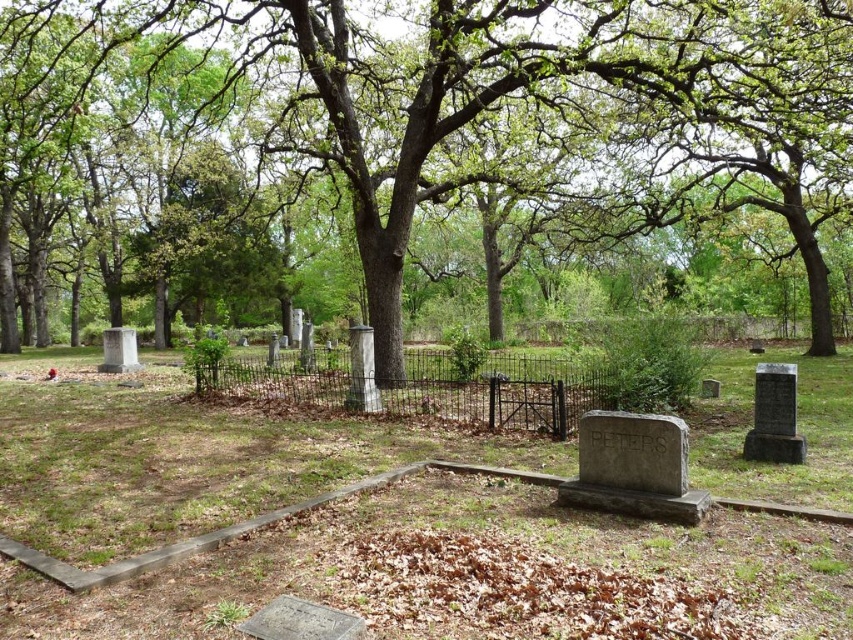
The image size is (853, 640). What do you see at coordinates (190, 456) in the screenshot? I see `gray stone marker at center` at bounding box center [190, 456].

Is point (537, 465) farther from viewer compared to point (607, 465)?

Yes.

This screenshot has width=853, height=640. What do you see at coordinates (190, 456) in the screenshot?
I see `gray stone marker at center` at bounding box center [190, 456].

This screenshot has width=853, height=640. Identify the location of gray stone marker at center. (190, 456).

This screenshot has height=640, width=853. Find the location of `green leafy tree at center`. green leafy tree at center is located at coordinates (523, 96).

Does green leafy tree at center have a greater height compared to gray stone gravestone at center?

Correct, green leafy tree at center is much taller as gray stone gravestone at center.

Is point (577, 81) less distant than point (676, 486)?

No.

Image resolution: width=853 pixels, height=640 pixels. I want to click on green leafy tree at center, so click(523, 96).

Is gray stone gravestone at center wider than white marble gravestone at left?

No, gray stone gravestone at center is not wider than white marble gravestone at left.

Find the location of a particular element. This screenshot has height=640, width=853. gray stone gravestone at center is located at coordinates (633, 467).

Find the location of a particular element. The image size is (853, 640). gray stone gravestone at center is located at coordinates (633, 467).